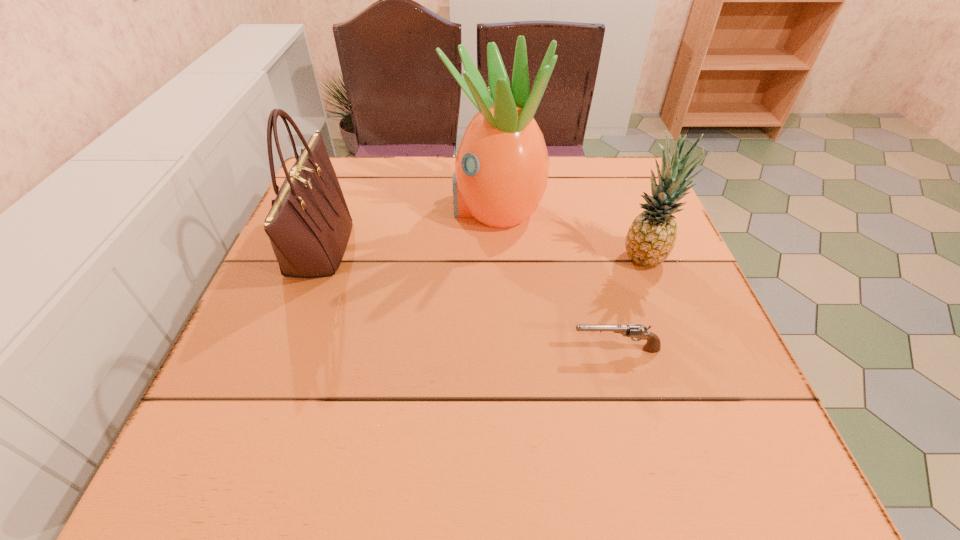
Image resolution: width=960 pixels, height=540 pixels. Find the location of `the tallest object`. the tallest object is located at coordinates (501, 169).

Where is `the left pineapple`? The height and width of the screenshot is (540, 960). the left pineapple is located at coordinates (501, 169).

The height and width of the screenshot is (540, 960). What are the coordinates of `handbag` in the screenshot? It's located at (309, 224).

What are the coordinates of `the shorter pineapple` in the screenshot? It's located at (651, 237).

This screenshot has width=960, height=540. Identify the location of the shortest object. (653, 344).

Identify the location of gun. (653, 344).

Find the location of a particular element. Image resolution: width=960 pixels, height=540 pixels. blank space located at the entrance of the taller pineapple is located at coordinates 391,208.

Where is `free location located 0.070m at the entrance of the taller pineapple`? The width and height of the screenshot is (960, 540). free location located 0.070m at the entrance of the taller pineapple is located at coordinates (419, 208).

Where is `vacant area located 0.200m at the entrance of the taller pineapple`? vacant area located 0.200m at the entrance of the taller pineapple is located at coordinates (367, 208).

Identify the location of free space located 0.320m on the front-facing side of the handbag. The width and height of the screenshot is (960, 540). (491, 248).